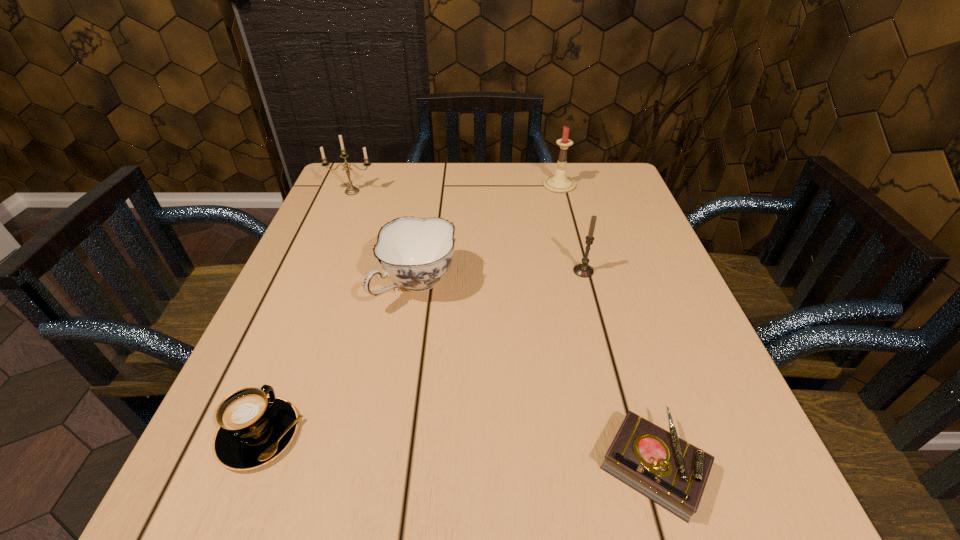
You are a GUI agent. You are given a task and a screenshot of the screen. Output one action in this format:
    pyautogui.click(x=<x>, y=<y>)
    Task: Click on the vacant space located 0.190m on the left of the diary
    
    Given the screenshot: What is the action you would take?
    pyautogui.click(x=465, y=466)

Identify the location of cappuccino that is at the near edge. The width and height of the screenshot is (960, 540). (254, 429).

The height and width of the screenshot is (540, 960). Identify the location of diary situated at the near edge. (673, 473).

Find the location of a particular element. The height and width of the screenshot is (540, 960). candle that is at the left edge is located at coordinates (351, 190).

The image size is (960, 540). Identify the location of cappuccino that is at the left edge. (254, 429).

Where is `diary at the right edge`? The image size is (960, 540). diary at the right edge is located at coordinates (673, 473).

You are a GUI agent. You are given a task and a screenshot of the screen. Output one action in this format:
    pyautogui.click(x=<x>, y=<y>)
    Task: Click on the object present at the far left corner
    This screenshot has width=960, height=540.
    Given the screenshot: What is the action you would take?
    pyautogui.click(x=351, y=190)

I want to click on object situated at the near left corner, so click(x=254, y=429).

Locate an element on the screen. This screenshot has height=540, width=960. object located at the far right corner is located at coordinates (558, 183).

Where is `object located at the near right corner`? This screenshot has width=960, height=540. object located at the near right corner is located at coordinates (673, 473).